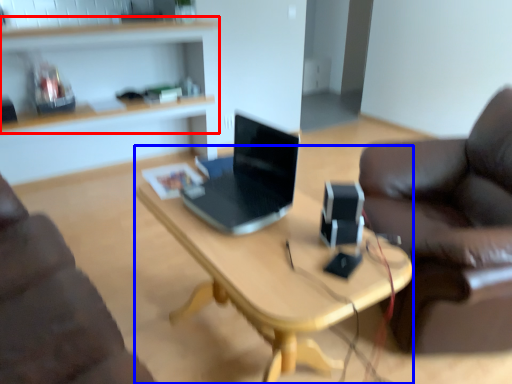
Question: Which of the following is the farthest to the observer, shelf (highlighted by a red box) or desk (highlighted by a blue box)?

Choices:
 (A) shelf
 (B) desk

Answer: (A)